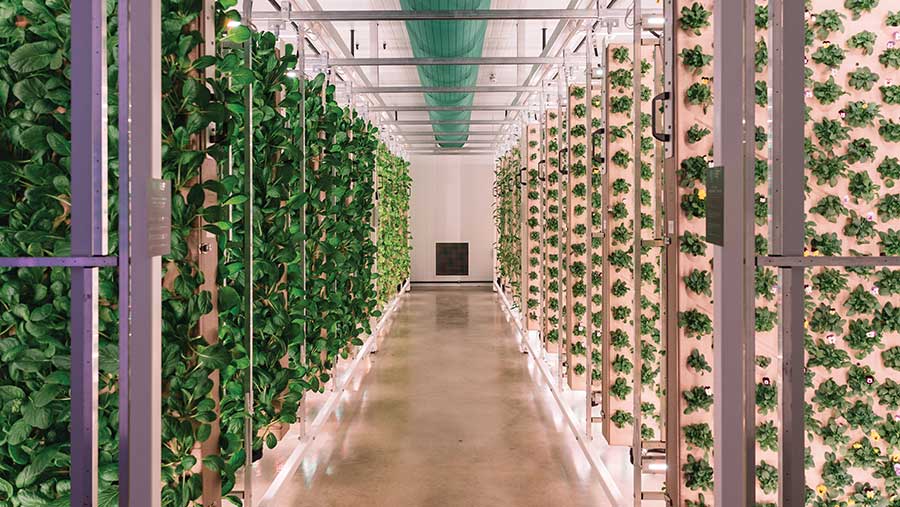
The width and height of the screenshot is (900, 507). In order to click on floor in this screenshot , I will do `click(438, 397)`.